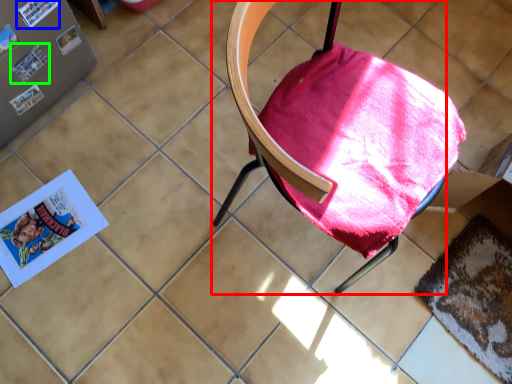
Question: Based on their relative distances, which object is nearer to chair (highlighted by a red box)? Choose from paperback book (highlighted by a blue box) and paperback book (highlighted by a green box).

Choices:
 (A) paperback book
 (B) paperback book

Answer: (A)